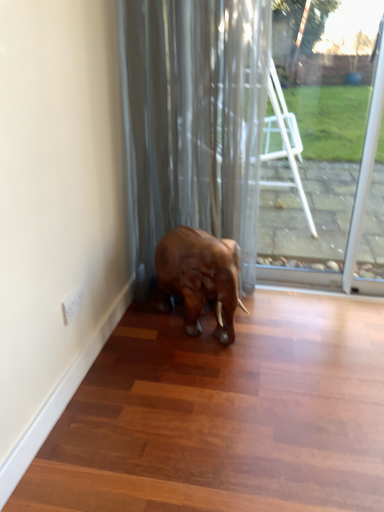
In order to face shiny brown elephant at center, should I rotate leftwards or rightwards?

You should rotate right by 1.263 degrees.

Image resolution: width=384 pixels, height=512 pixels. What do you see at coordinates (329, 164) in the screenshot?
I see `transparent glass door at center` at bounding box center [329, 164].

Find the location of a particular element. satin gray curtain at center is located at coordinates (194, 121).

The width and height of the screenshot is (384, 512). I want to click on shiny brown elephant at center, so click(x=199, y=278).

From the image's perspective, which is above, transparent glass door at center or satin gray curtain at center?

satin gray curtain at center.

Considering the relative sizes of transparent glass door at center and satin gray curtain at center in the image provided, is transparent glass door at center smaller than satin gray curtain at center?

Yes.

Is transparent glass door at center at the right side of satin gray curtain at center?

Yes, transparent glass door at center is to the right of satin gray curtain at center.

Can you see satin gray curtain at center touching shiny brown elephant at center?

satin gray curtain at center and shiny brown elephant at center are not in contact.

Which object is thinner, satin gray curtain at center or shiny brown elephant at center?

Thinner between the two is satin gray curtain at center.

Is satin gray curtain at center positioned with its back to shiny brown elephant at center?

Correct, satin gray curtain at center is looking away from shiny brown elephant at center.

Is satin gray curtain at center bigger or smaller than shiny brown elephant at center?

satin gray curtain at center is bigger than shiny brown elephant at center.

Can you confirm if shiny brown elephant at center is wider than transparent glass door at center?

Yes, shiny brown elephant at center is wider than transparent glass door at center.

Where is `elephant beneath the transparent glass door at center (from a real-world perspective)`? This screenshot has width=384, height=512. elephant beneath the transparent glass door at center (from a real-world perspective) is located at coordinates (199, 278).

Which is behind, shiny brown elephant at center or transparent glass door at center?

transparent glass door at center.

Which is behind, point (171, 234) or point (263, 170)?

The point (263, 170) is farther.

Can you confirm if satin gray curtain at center is positioned to the left of transparent glass door at center?

Yes, satin gray curtain at center is to the left of transparent glass door at center.

Identify the location of glass door on the right side of satin gray curtain at center. (329, 164).

Is point (186, 143) more distant than point (350, 92)?

No, (186, 143) is in front of (350, 92).

From the image's perspective, which one is positioned lower, shiny brown elephant at center or satin gray curtain at center?

shiny brown elephant at center is shown below in the image.

Is shiny brown elephant at center smaller than satin gray curtain at center?

Indeed, shiny brown elephant at center has a smaller size compared to satin gray curtain at center.

Does shiny brown elephant at center touch satin gray curtain at center?

No, shiny brown elephant at center is not beside satin gray curtain at center.

From the image's perspective, relative to shiny brown elephant at center, is transparent glass door at center above or below?

From the image's perspective, transparent glass door at center appears above shiny brown elephant at center.

How much distance is there between transparent glass door at center and shiny brown elephant at center?

3.61 feet.

Which object is closer to the camera, transparent glass door at center or shiny brown elephant at center?

shiny brown elephant at center is in front.

Where is `elephant to the left of transparent glass door at center`? elephant to the left of transparent glass door at center is located at coordinates (199, 278).

Where is `curtain that is in front of the transparent glass door at center`? The image size is (384, 512). curtain that is in front of the transparent glass door at center is located at coordinates (194, 121).

Where is `curtain above the shiny brown elephant at center (from the image's perspective)`? This screenshot has width=384, height=512. curtain above the shiny brown elephant at center (from the image's perspective) is located at coordinates (194, 121).

When comparing their distances from transparent glass door at center, does shiny brown elephant at center or satin gray curtain at center seem further?

shiny brown elephant at center is further to transparent glass door at center.

From the image, which object appears to be nearer to shiny brown elephant at center, satin gray curtain at center or transparent glass door at center?

Based on the image, satin gray curtain at center appears to be nearer to shiny brown elephant at center.

Estimate the real-world distances between objects in this image. Which object is closer to shiny brown elephant at center, transparent glass door at center or satin gray curtain at center?

Among the two, satin gray curtain at center is located nearer to shiny brown elephant at center.

Consider the image. Based on their spatial positions, is shiny brown elephant at center or transparent glass door at center further from satin gray curtain at center?

transparent glass door at center.

Looking at this image, looking at the image, which one is located closer to satin gray curtain at center, transparent glass door at center or shiny brown elephant at center?

Based on the image, shiny brown elephant at center appears to be nearer to satin gray curtain at center.

Which object lies nearer to the anchor point transparent glass door at center, satin gray curtain at center or shiny brown elephant at center?

The object closer to transparent glass door at center is satin gray curtain at center.

Locate an element on the screen. The image size is (384, 512). glass door between satin gray curtain at center and shiny brown elephant at center from top to bottom is located at coordinates (329, 164).